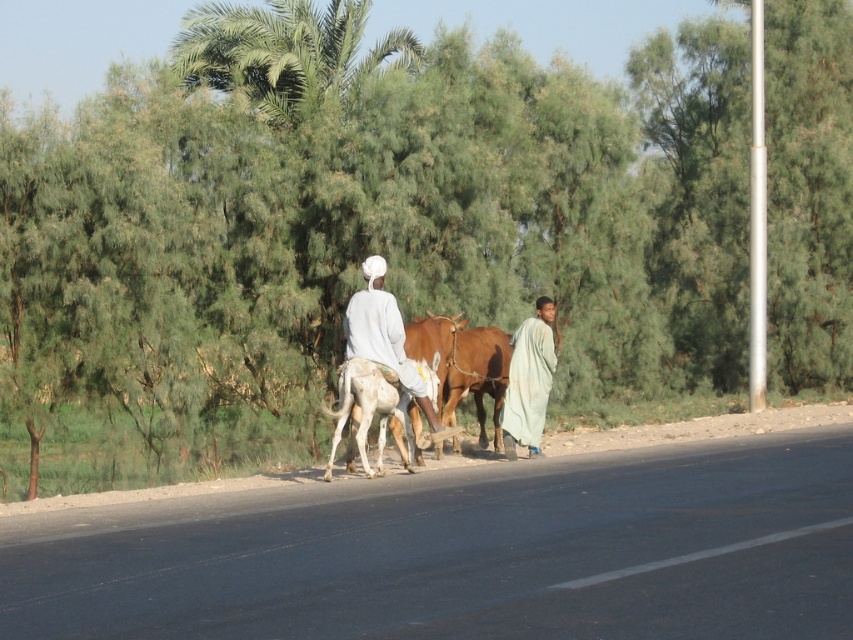
You are a photographer standing at the edge of the road. You want to take a photo of both the white cloth at center and the white smooth donkey at center. How far apart are these two objects in the scene?

The white cloth at center is 19.14 inches away from the white smooth donkey at center.

You are a photographer positioned at the edge of the road. You want to take a photo of the brown glossy bull at center and the light green fabric at center. Based on their positions, which object should appear closer to the left side of the photo?

The brown glossy bull at center is positioned to the left of the light green fabric at center, so in the photo, the brown glossy bull at center will appear closer to the left side.